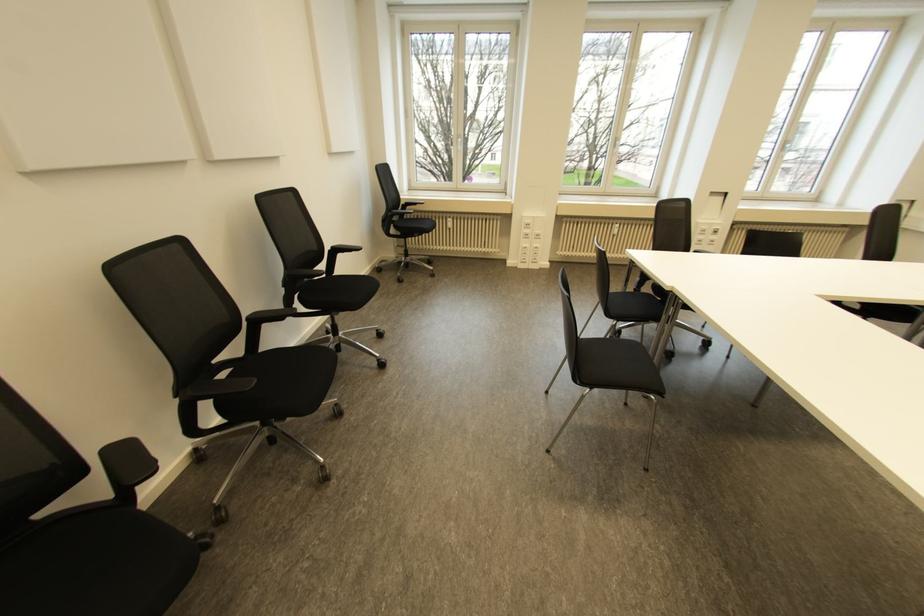
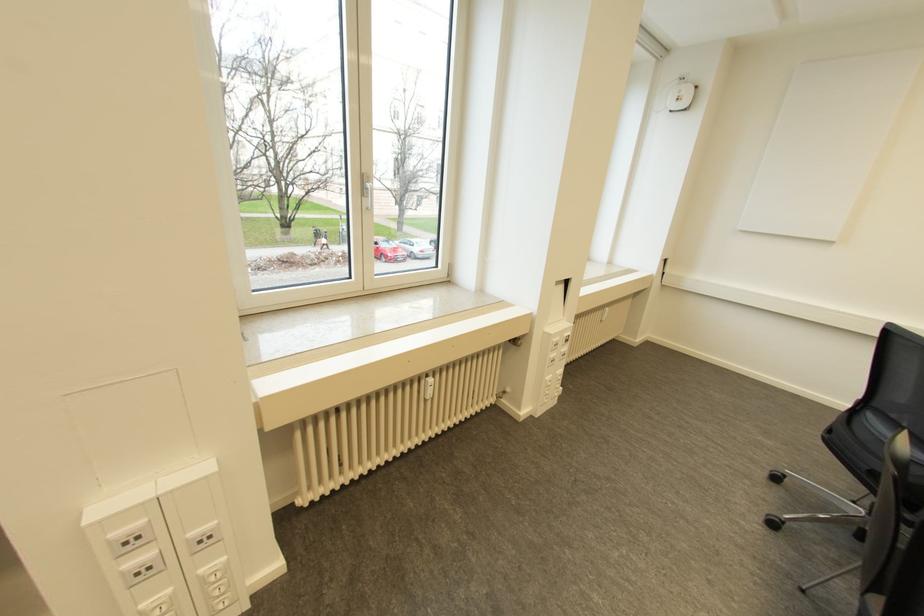
Locate, in the second image, the point that corresponds to point 536,232 in the first image.

(197, 531)